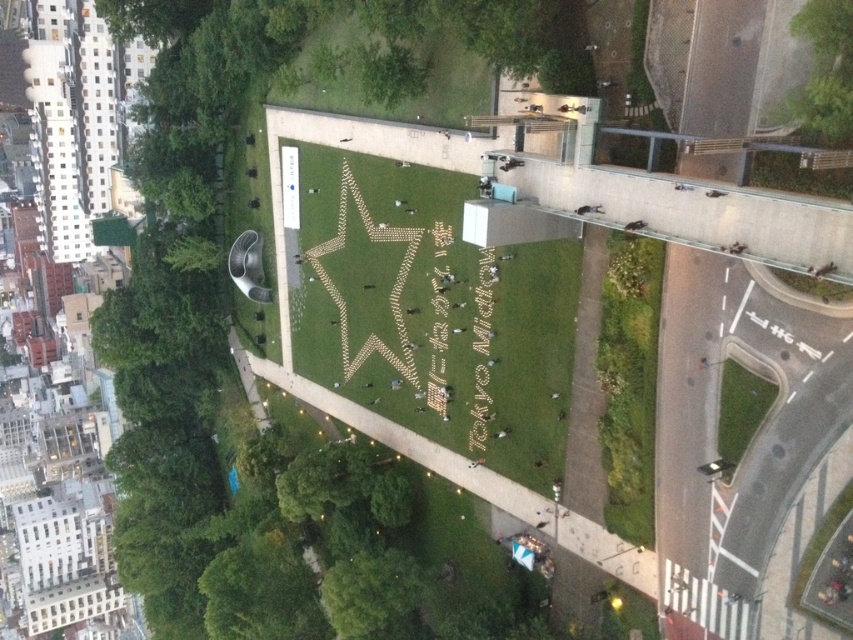
You are a drone operator trying to capture a photo of the star pattern in the park. You need to ensure that the green leafy tree at lower left and the green leafy tree at lower center do not block the view. Which tree should you avoid flying near to keep the star pattern visible?

The green leafy tree at lower left is much taller than the green leafy tree at lower center, so you should avoid flying near the green leafy tree at lower left to keep the star pattern visible.